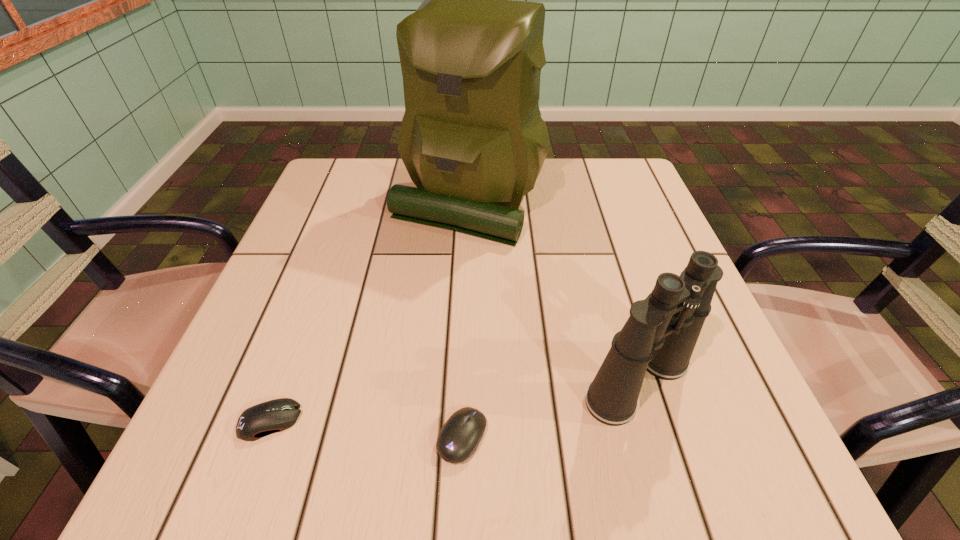
Find the location of `the tallest object`. the tallest object is located at coordinates (472, 139).

Find the location of a particular element. This screenshot has height=540, width=960. the farthest object is located at coordinates (472, 139).

The width and height of the screenshot is (960, 540). Find the location of `the second tallest object`. the second tallest object is located at coordinates (660, 335).

Image resolution: width=960 pixels, height=540 pixels. What are the coordinates of `binoculars` in the screenshot? It's located at (660, 335).

At what (x,y) coordinates should I click in order to perform the action: click on the right computer equipment. Please return your answer as a coordinate pair (x, y). The width and height of the screenshot is (960, 540). Looking at the image, I should click on (459, 437).

The image size is (960, 540). What are the coordinates of `the left computer equipment` in the screenshot? It's located at (277, 415).

This screenshot has width=960, height=540. I want to click on free region located 0.080m on the front of the tallest object with visible pockets, so click(466, 274).

The height and width of the screenshot is (540, 960). Find the location of `vacant region located 0.080m on the front of the binoculars`. vacant region located 0.080m on the front of the binoculars is located at coordinates (667, 483).

Locate an element on the screen. vacant region located on the back of the right computer equipment is located at coordinates (465, 371).

The width and height of the screenshot is (960, 540). I want to click on free spot located on the back of the leftmost object, so click(321, 283).